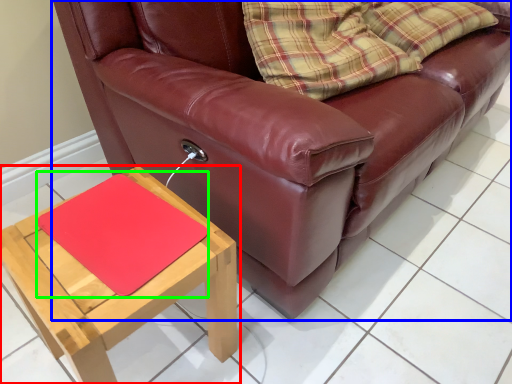
Question: Based on their relative distances, which object is farther from table (highlighted by a red box)? Choose from studio couch (highlighted by a blue box) and mat (highlighted by a green box).

Choices:
 (A) studio couch
 (B) mat

Answer: (A)